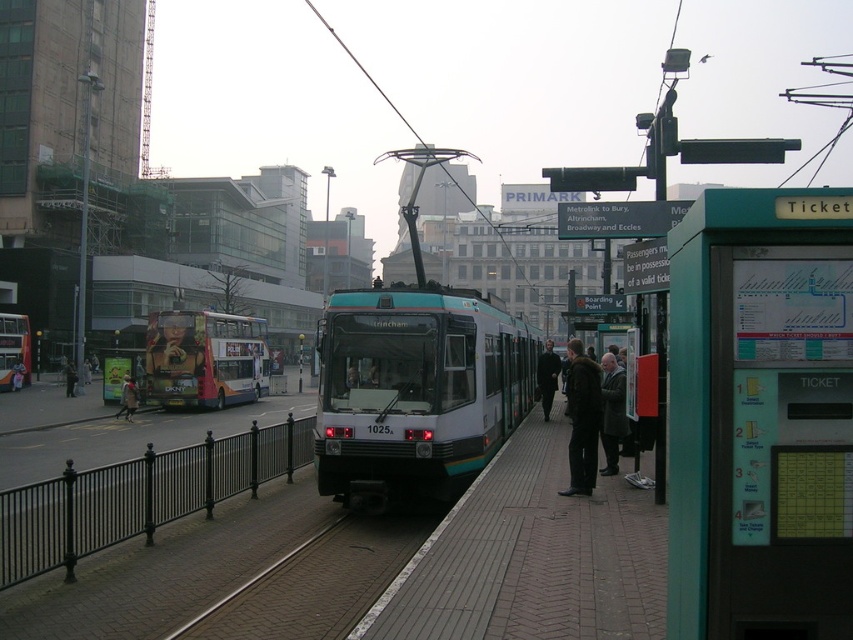
You are a delivery person carrying a package that requires a distance of at least 20 feet from any moving vehicles for safety. You see the teal glossy tram at center and the dark gray wool coat at center. Can you safely place your package between them?

The teal glossy tram at center and dark gray wool coat at center are 21.35 feet apart, which is more than the required 20 feet distance. Therefore, you can safely place your package between them.

You are a passenger waiting at the tram station. You notice the teal glossy tram at center and the dark gray wool coat at center. Which object is positioned higher relative to the other?

The teal glossy tram at center is located above the dark gray wool coat at center, so it is positioned higher.

You are a passenger on the tram and need to choose between two coats hanging nearby. The coats are the dark brown leather coat at center and the denim jacket at left. Which coat is bigger?

The dark brown leather coat at center is larger in size than the denim jacket at left.